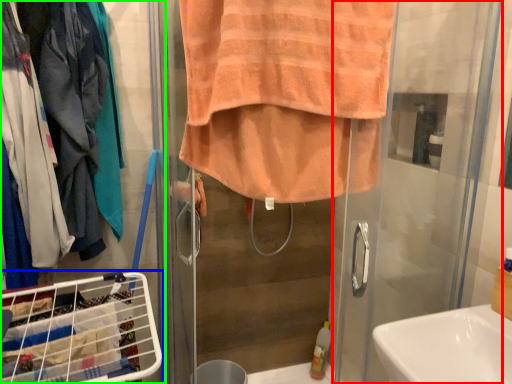
Question: Which object is the farthest from screen door (highlighted by a red box)? Choose among these: laundry basket (highlighted by a blue box) or closet (highlighted by a green box).

Choices:
 (A) laundry basket
 (B) closet

Answer: (A)